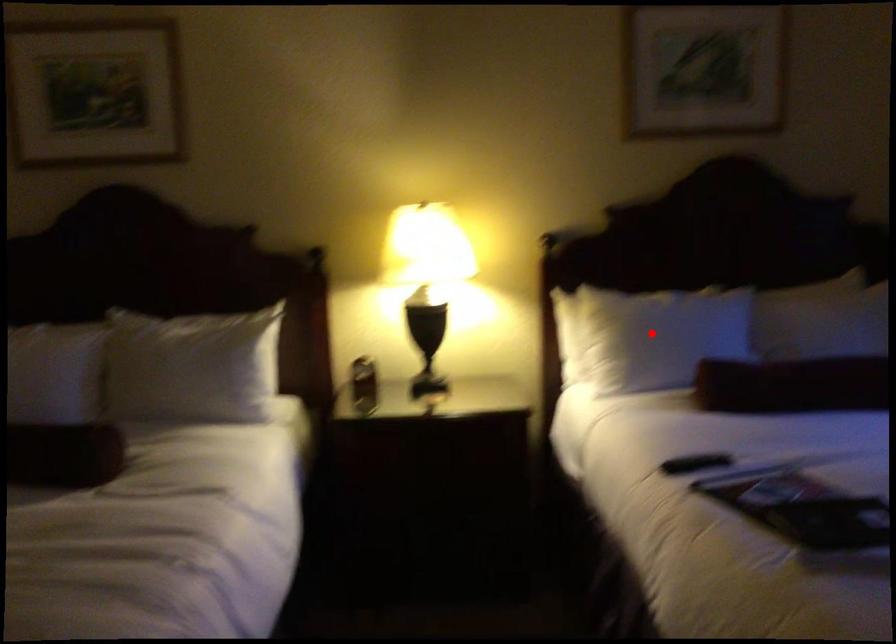
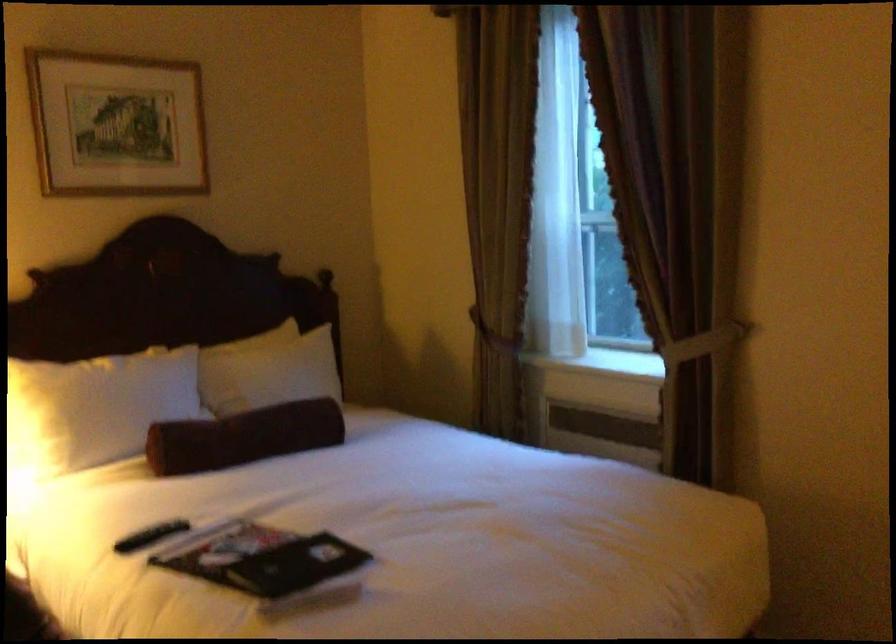
The point at the highlighted location is marked in the first image. Where is the corresponding point in the second image?

(95, 408)